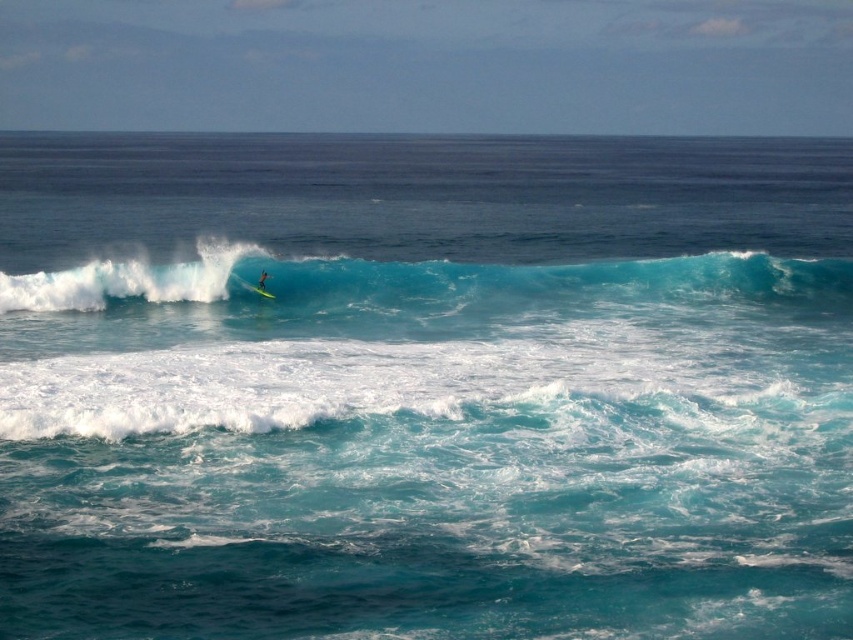
Question: Which point is closer to the camera?

Choices:
 (A) translucent blue wave at center
 (B) yellow-green smooth surfboard at center
 (C) yellow surfboard at center

Answer: (A)

Question: Which is farther from the yellow surfboard at center?

Choices:
 (A) yellow-green smooth surfboard at center
 (B) translucent blue wave at center

Answer: (B)

Question: Which point appears closest to the camera in this image?

Choices:
 (A) (262, 280)
 (B) (561, 268)
 (C) (242, 280)

Answer: (A)

Question: Is translucent blue wave at center positioned in front of yellow surfboard at center?

Choices:
 (A) yes
 (B) no

Answer: (A)

Question: Is translucent blue wave at center to the left of yellow-green smooth surfboard at center from the viewer's perspective?

Choices:
 (A) yes
 (B) no

Answer: (B)

Question: Can you confirm if yellow-green smooth surfboard at center is thinner than yellow surfboard at center?

Choices:
 (A) no
 (B) yes

Answer: (A)